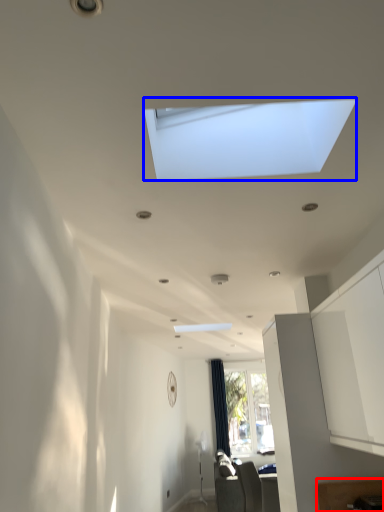
Question: Among these objects, which one is farthest to the camera, furniture (highlighted by a red box) or window (highlighted by a blue box)?

Choices:
 (A) furniture
 (B) window

Answer: (A)